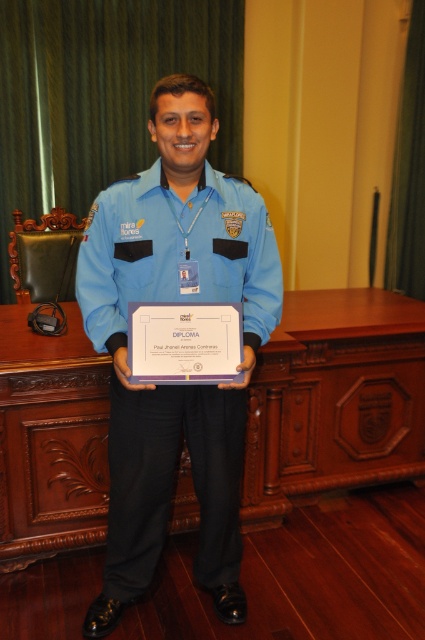
Question: Which of the following is the closest to the observer?

Choices:
 (A) wooden at center
 (B) blue fabric uniform at center

Answer: (B)

Question: Which of the following is the farthest from the observer?

Choices:
 (A) blue fabric uniform at center
 (B) wooden at center

Answer: (B)

Question: In this image, where is wooden at center located relative to blue fabric uniform at center?

Choices:
 (A) left
 (B) right

Answer: (B)

Question: Is wooden at center below blue fabric uniform at center?

Choices:
 (A) yes
 (B) no

Answer: (A)

Question: Can you confirm if wooden at center is positioned below blue fabric uniform at center?

Choices:
 (A) yes
 (B) no

Answer: (A)